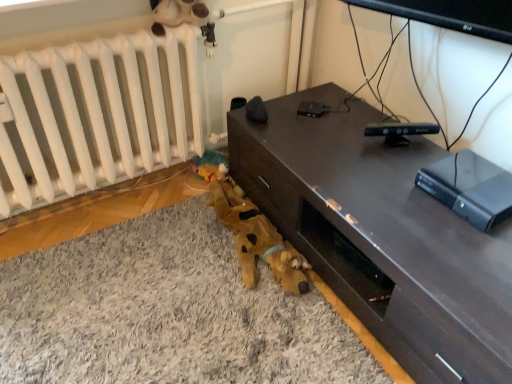
Question: Is black plastic remote control at upper center, which ranks as the first gadget in front-to-back order, not near white matte radiator at lower left?

Choices:
 (A) yes
 (B) no

Answer: (B)

Question: Is black plastic remote control at upper center, positioned as the 2th gadget in back-to-front order, to the right of white matte radiator at lower left from the viewer's perspective?

Choices:
 (A) no
 (B) yes

Answer: (B)

Question: Considering the relative positions of black plastic remote control at upper center, which ranks as the first gadget in front-to-back order, and white matte radiator at lower left in the image provided, is black plastic remote control at upper center, which ranks as the first gadget in front-to-back order, behind white matte radiator at lower left?

Choices:
 (A) yes
 (B) no

Answer: (A)

Question: Can you confirm if black plastic remote control at upper center, marked as the first gadget in a right-to-left arrangement, is wider than white matte radiator at lower left?

Choices:
 (A) yes
 (B) no

Answer: (B)

Question: From a real-world perspective, is black plastic remote control at upper center, acting as the 1th gadget starting from the bottom, located beneath white matte radiator at lower left?

Choices:
 (A) no
 (B) yes

Answer: (A)

Question: Is black plastic remote control at upper center, positioned as the 2th gadget in back-to-front order, bigger or smaller than white matte radiator at lower left?

Choices:
 (A) small
 (B) big

Answer: (A)

Question: Would you say black plastic remote control at upper center, which appears as the second gadget when viewed from the top, is to the left or to the right of white matte radiator at lower left in the picture?

Choices:
 (A) left
 (B) right

Answer: (B)

Question: In terms of width, does black plastic remote control at upper center, marked as the first gadget in a right-to-left arrangement, look wider or thinner when compared to white matte radiator at lower left?

Choices:
 (A) thin
 (B) wide

Answer: (A)

Question: Which is correct: black plastic remote control at upper center, marked as the first gadget in a right-to-left arrangement, is inside white matte radiator at lower left, or outside of it?

Choices:
 (A) outside
 (B) inside

Answer: (A)

Question: In the image, is white matte radiator at lower left on the left side or the right side of dark wood desk at center?

Choices:
 (A) right
 (B) left

Answer: (B)

Question: Is white matte radiator at lower left in front of or behind dark wood desk at center in the image?

Choices:
 (A) front
 (B) behind

Answer: (B)

Question: Considering the positions of point (28, 82) and point (459, 231), is point (28, 82) closer or farther from the camera than point (459, 231)?

Choices:
 (A) closer
 (B) farther

Answer: (B)

Question: Is white matte radiator at lower left inside the boundaries of dark wood desk at center, or outside?

Choices:
 (A) outside
 (B) inside

Answer: (A)

Question: Is brown plush toy at lower left to the left or to the right of black plastic remote control at center, placed as the 1th gadget when sorted from back to front, in the image?

Choices:
 (A) left
 (B) right

Answer: (A)

Question: From a real-world perspective, is brown plush toy at lower left above or below black plastic remote control at center, acting as the second gadget starting from the right?

Choices:
 (A) above
 (B) below

Answer: (B)